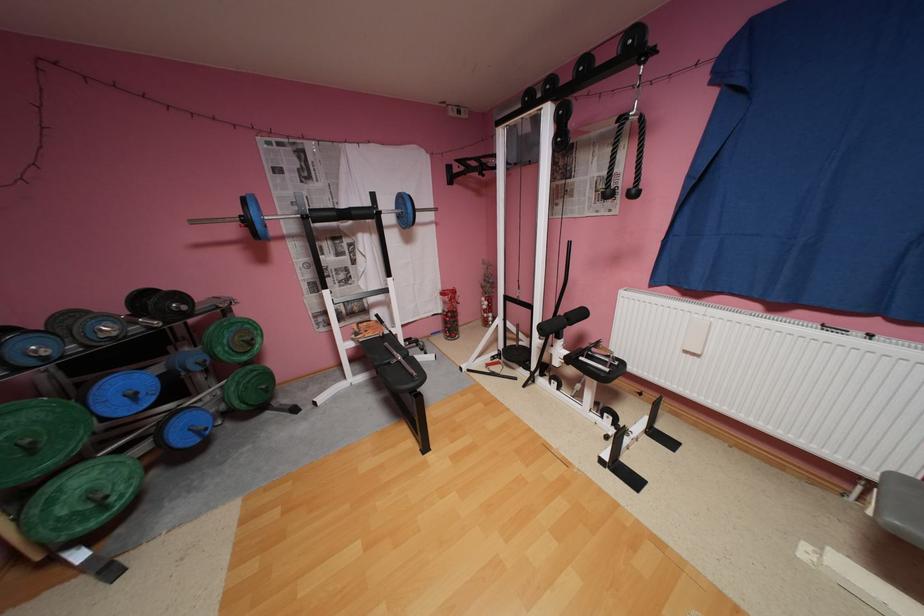
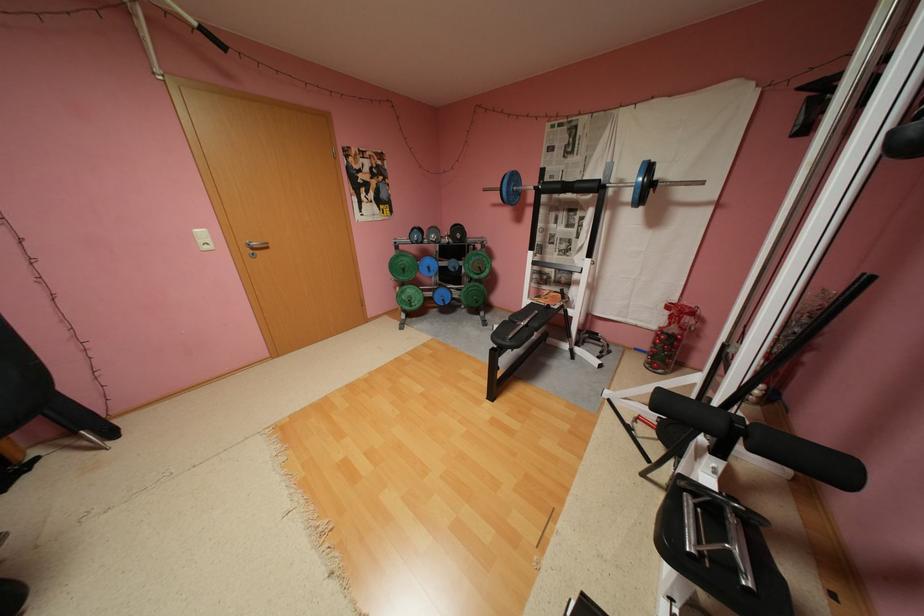
Locate, in the second image, the point that corresponds to pixel 362 213 in the first image.

(586, 185)